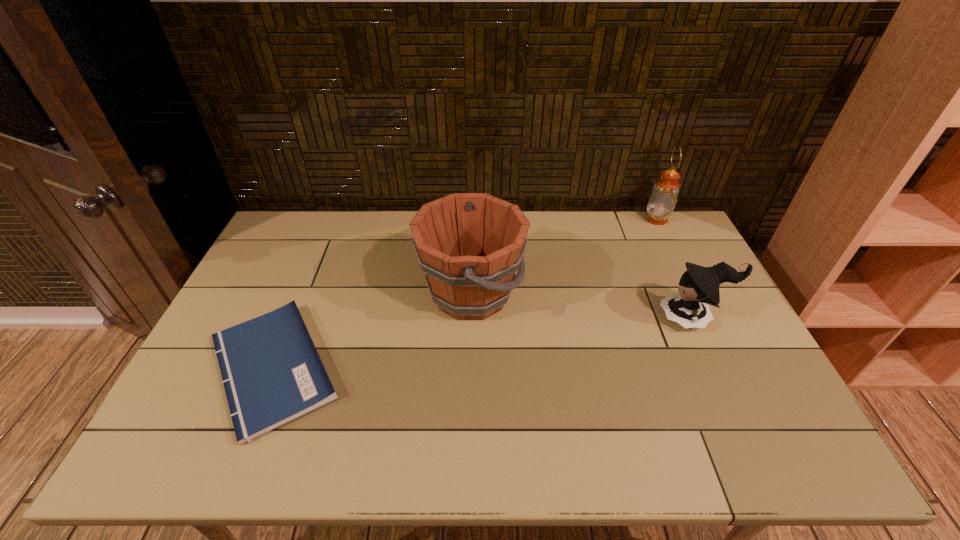
You are a GUI agent. You are given a task and a screenshot of the screen. Output one action in this format:
    pyautogui.click(x=<x>, y=<y>)
    Task: Click on the farthest object
    
    Given the screenshot: What is the action you would take?
    pyautogui.click(x=663, y=199)

Locate an element on the screen. The width and height of the screenshot is (960, 540). bucket is located at coordinates (470, 245).

This screenshot has height=540, width=960. Find the location of `the third tallest object`. the third tallest object is located at coordinates click(x=699, y=285).

Where is `the shortest object`? The height and width of the screenshot is (540, 960). the shortest object is located at coordinates (272, 373).

The width and height of the screenshot is (960, 540). Find the location of `the leftmost object`. the leftmost object is located at coordinates (272, 373).

The height and width of the screenshot is (540, 960). Find the location of `vacant space situated 0.100m on the front of the oil lamp`. vacant space situated 0.100m on the front of the oil lamp is located at coordinates (669, 245).

Where is `free region located 0.400m on the handle side of the third object from right to left`? The image size is (960, 540). free region located 0.400m on the handle side of the third object from right to left is located at coordinates (653, 294).

You are a GUI agent. You are given a task and a screenshot of the screen. Output one action in this format:
    pyautogui.click(x=<x>, y=<y>)
    Task: Click on the vacant region located 0.360m at the face of the third tallest object
    The image size is (960, 540).
    Given the screenshot: What is the action you would take?
    pyautogui.click(x=537, y=318)

Locate an element on the screen. The height and width of the screenshot is (540, 960). vacant space located 0.170m at the face of the third tallest object is located at coordinates (601, 318).

Where is `vacant space located at the face of the third tallest object`? Image resolution: width=960 pixels, height=540 pixels. vacant space located at the face of the third tallest object is located at coordinates (612, 318).